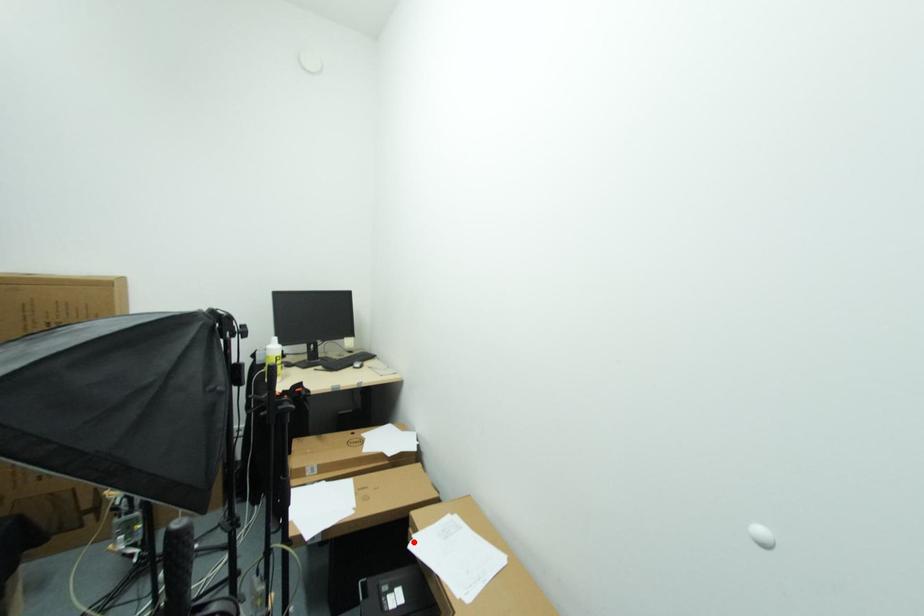
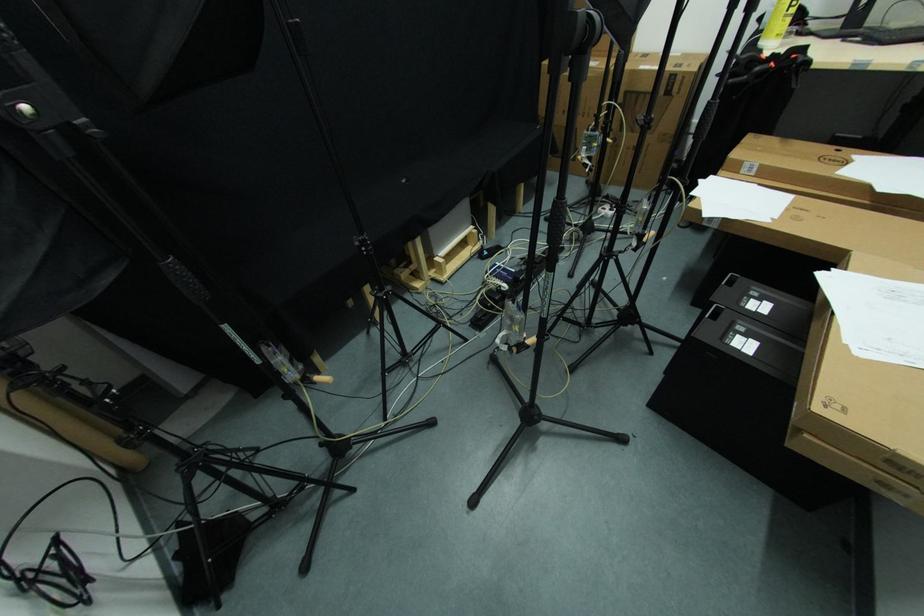
In the second image, find the point that corresponds to the highlighted location in the first image.

(830, 273)